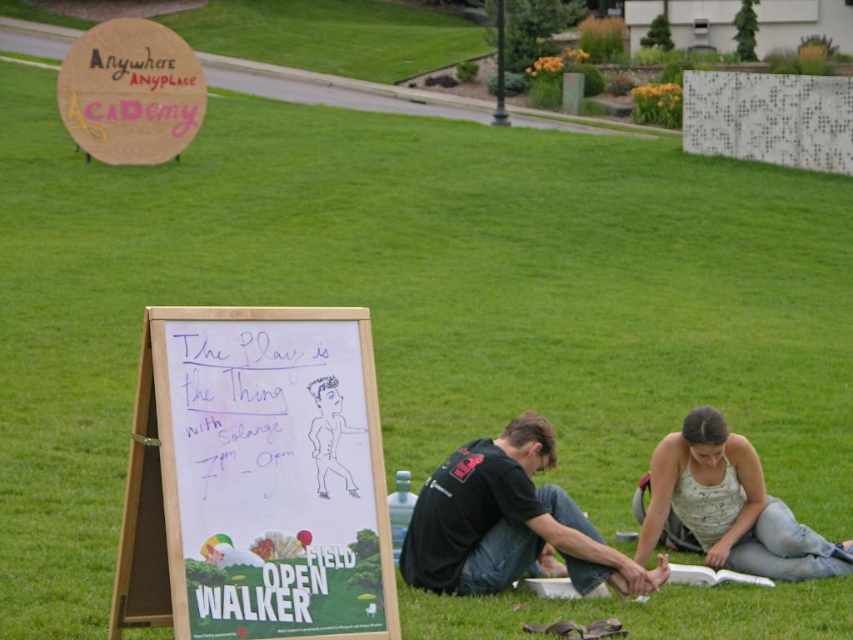
Consider the image. You are an actor looking for the location of the play rehearsal. You see the white cotton tank top at lower right and the wooden signboard at upper left. Which object is located more to the right side of the scene?

The white cotton tank top at lower right is positioned on the right side of wooden signboard at upper left, so it is located more to the right side of the scene.